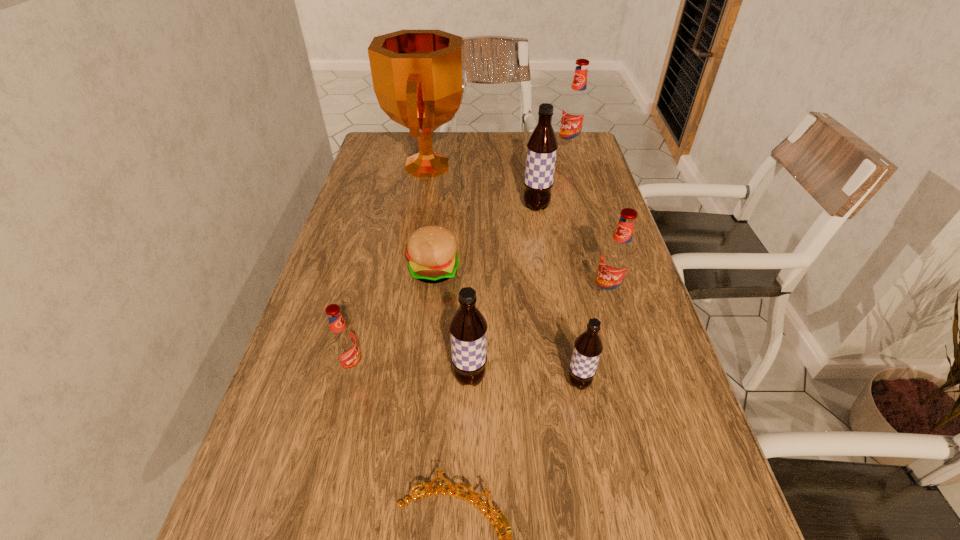
The image size is (960, 540). I want to click on free space located 0.270m on the left of the smallest brown root beer, so 427,383.

Locate an element on the screen. This screenshot has width=960, height=540. vacant space located on the right of the beige hamburger is located at coordinates (549, 270).

I want to click on award that is at the far edge, so click(x=419, y=80).

This screenshot has width=960, height=540. I want to click on root beer at the far edge, so click(575, 109).

Where is `award that is positioned at the left edge`? The height and width of the screenshot is (540, 960). award that is positioned at the left edge is located at coordinates (419, 80).

What are the coordinates of `root beer at the left edge` in the screenshot? It's located at (343, 342).

You are a GUI agent. You are given a task and a screenshot of the screen. Output one action in this format:
    pyautogui.click(x=<x>, y=<y>)
    Task: Click on the object that is at the far left corner
    Image resolution: width=960 pixels, height=540 pixels.
    Given the screenshot: What is the action you would take?
    pyautogui.click(x=419, y=80)

Where is `object situated at the far right corner`? object situated at the far right corner is located at coordinates (575, 109).

The width and height of the screenshot is (960, 540). I want to click on free space at the far edge of the desktop, so click(x=463, y=162).

In the image, there is a desktop. At what (x,y) coordinates should I click in order to perform the action: click on vacant space at the left edge. Please return your answer as a coordinate pair (x, y). The height and width of the screenshot is (540, 960). Looking at the image, I should click on (388, 178).